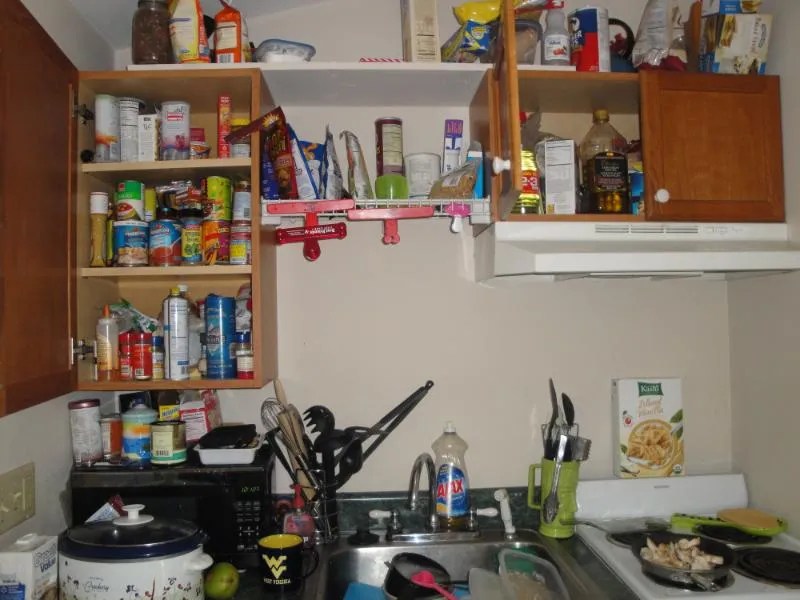
You are a GUI agent. You are given a task and a screenshot of the screen. Output one action in this format:
    pyautogui.click(x=<x>, y=<y>)
    Task: Click on the microwave
    The width and height of the screenshot is (800, 600).
    Given the screenshot: What is the action you would take?
    pyautogui.click(x=208, y=494)